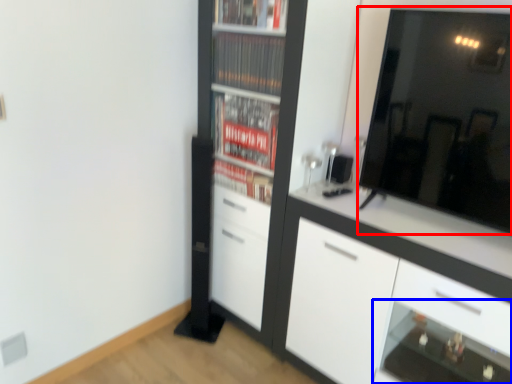
Question: Which point is further to the camera, mirror (highlighted by a red box) or shelf (highlighted by a blue box)?

Choices:
 (A) mirror
 (B) shelf

Answer: (B)